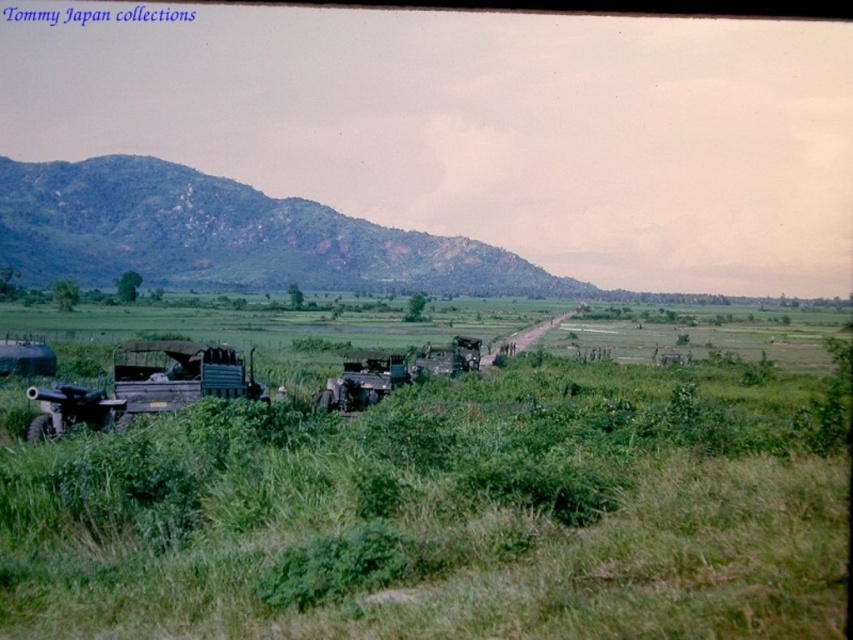
Consider the image. Which is more to the right, green textured hillside at upper left or green matte truck at left?

Positioned to the right is green matte truck at left.

Is point (167, 196) closer to camera compared to point (202, 369)?

That is False.

Where is `green textured hillside at upper left`? This screenshot has height=640, width=853. green textured hillside at upper left is located at coordinates (230, 236).